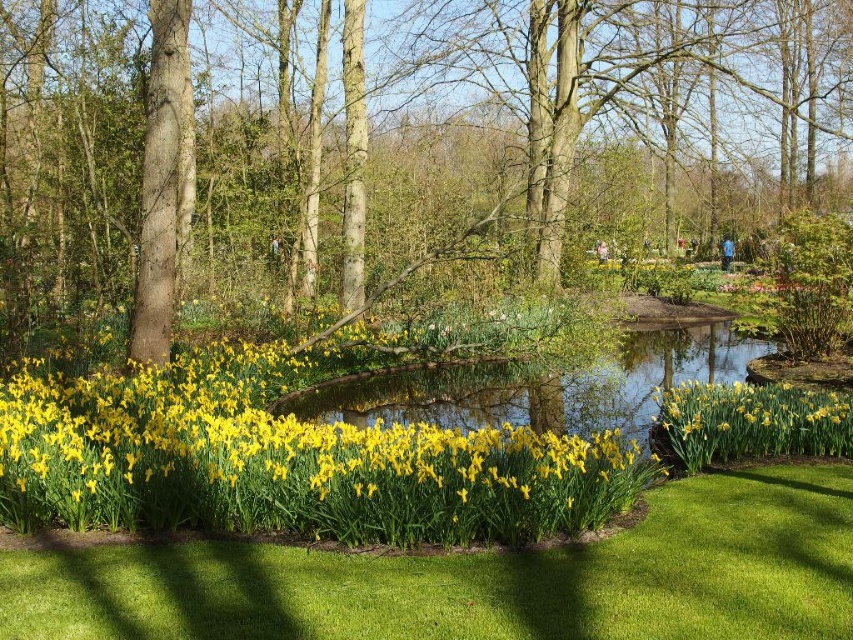
Question: Which object is farther from the camera taking this photo?

Choices:
 (A) yellow matte flowers at lower left
 (B) green grass at lower center
 (C) green leafy tree at center
 (D) yellow matte daffodil at lower center

Answer: (C)

Question: Estimate the real-world distances between objects in this image. Which object is farther from the yellow matte daffodil at lower center?

Choices:
 (A) green leafy tree at center
 (B) green grass at lower center
 (C) yellow matte flowers at lower left

Answer: (A)

Question: Is green leafy tree at center below yellow matte daffodil at lower center?

Choices:
 (A) yes
 (B) no

Answer: (B)

Question: Which point appears closest to the camera in this image?

Choices:
 (A) 776,172
 (B) 212,564

Answer: (B)

Question: Is green leafy tree at center to the right of yellow matte flowers at lower left from the viewer's perspective?

Choices:
 (A) yes
 (B) no

Answer: (A)

Question: From the image, what is the correct spatial relationship of yellow matte flowers at lower left in relation to yellow matte daffodil at lower center?

Choices:
 (A) right
 (B) left

Answer: (B)